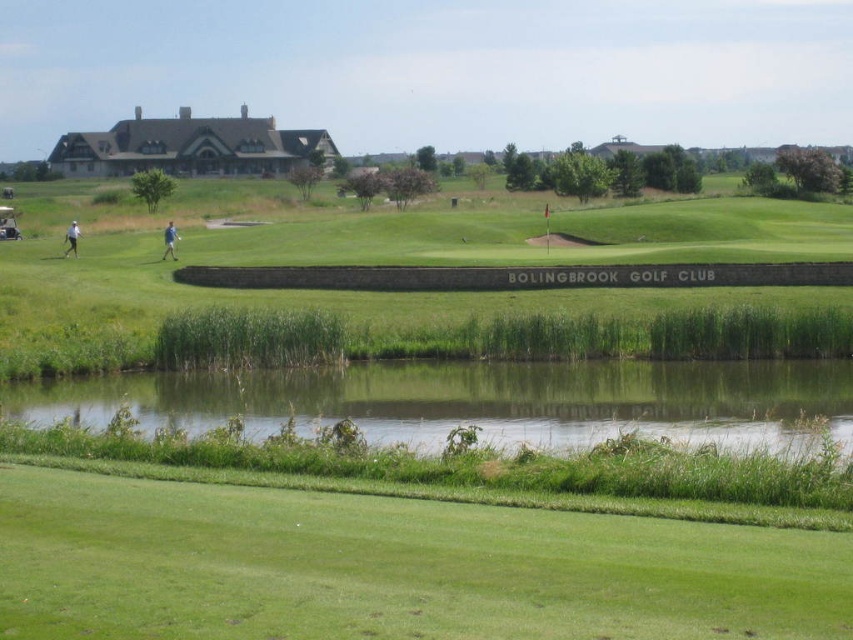
Does point (587, 376) come in front of point (170, 221)?

Yes, point (587, 376) is closer to viewer.

Between point (419, 385) and point (177, 236), which one is positioned in front?

Positioned in front is point (419, 385).

Does point (595, 406) lie behind point (161, 257)?

No, (595, 406) is closer to viewer.

Image resolution: width=853 pixels, height=640 pixels. What are the coordinates of `green liquid water at center` in the screenshot? It's located at (479, 401).

Is green liquid water at center positioned behind white fabric person at left?

No, it is not.

Find the location of a particular element. The image size is (853, 640). green liquid water at center is located at coordinates (479, 401).

Measure the distance between green liquid water at center and camera.

green liquid water at center and camera are 57.19 feet apart.

The height and width of the screenshot is (640, 853). Identify the location of green liquid water at center. (479, 401).

Can you confirm if green grass at upper center is shorter than white fabric person at left?

No.

Does green grass at upper center have a larger size compared to white fabric person at left?

Correct, green grass at upper center is larger in size than white fabric person at left.

The width and height of the screenshot is (853, 640). I want to click on green grass at upper center, so click(431, 324).